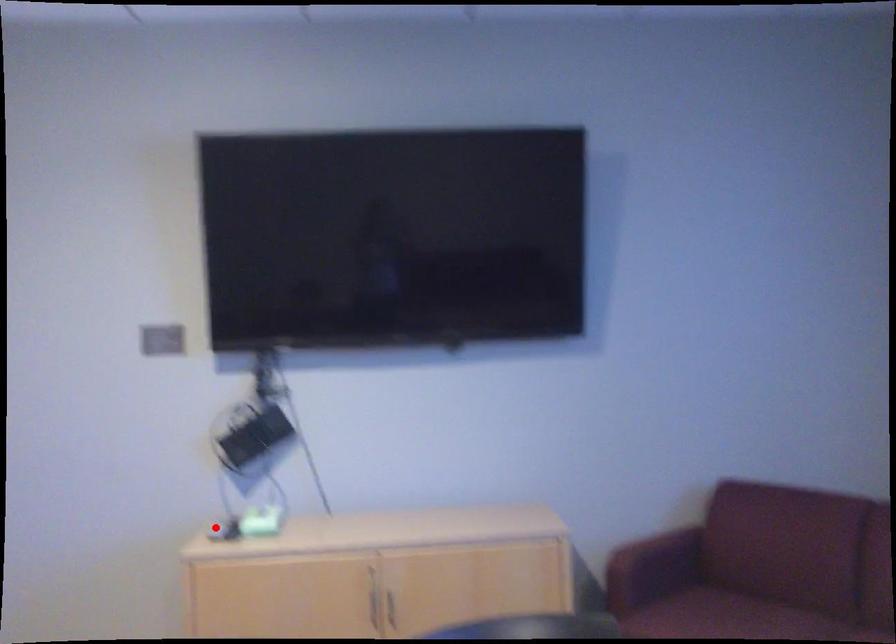
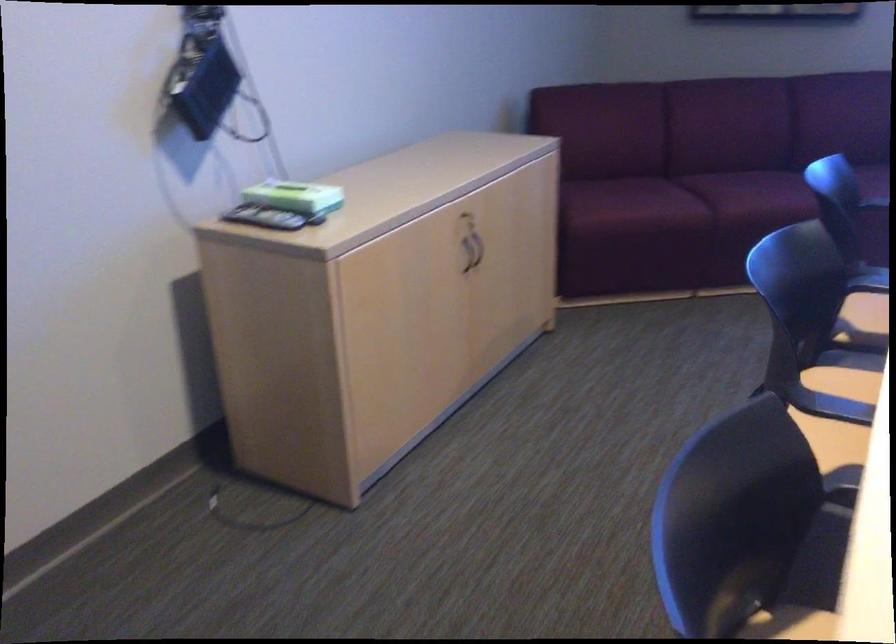
Find the pixel in the second image that matches the highlighted location in the first image.

(263, 218)